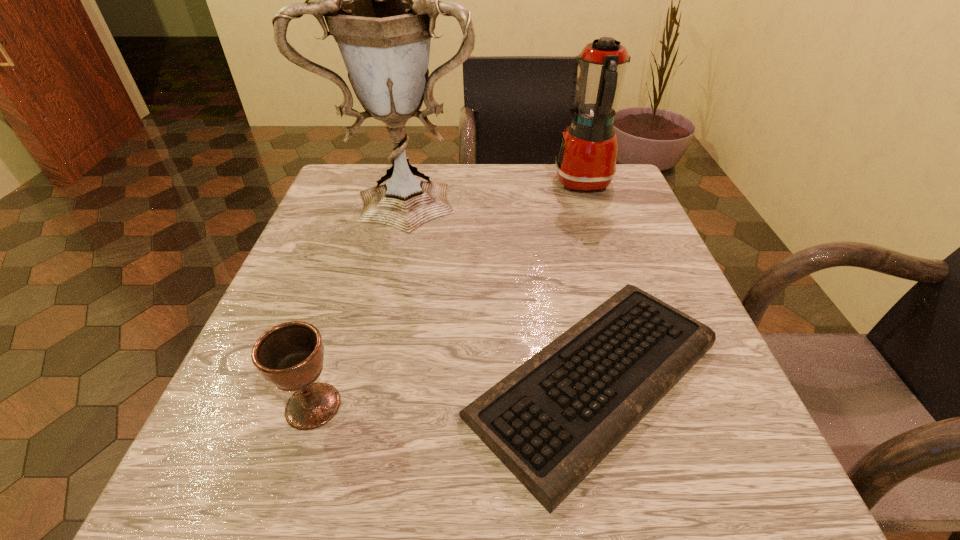
The width and height of the screenshot is (960, 540). Identify the location of free location at the far edge of the desktop. (566, 210).

The width and height of the screenshot is (960, 540). Identify the location of free space at the near edge of the desktop. (438, 453).

This screenshot has width=960, height=540. Identify the location of vacant space at the left edge. (334, 285).

In the image, there is a desktop. Where is `vacant space at the right edge`? vacant space at the right edge is located at coordinates click(x=605, y=295).

This screenshot has height=540, width=960. I want to click on vacant space at the near left corner, so click(214, 492).

Locate an element on the screen. vacant area at the far right corner is located at coordinates (628, 201).

Locate an element on the screen. The image size is (960, 540). free space between the food processor and the tallest object is located at coordinates (496, 190).

Where is `blank region between the food processor and the computer keyboard`? blank region between the food processor and the computer keyboard is located at coordinates (588, 281).

Where is `free space between the computer keyboard and the tallest object`? The image size is (960, 540). free space between the computer keyboard and the tallest object is located at coordinates (502, 287).

Locate an element on the screen. Image resolution: width=960 pixels, height=540 pixels. blank region between the second tallest object and the trophy cup is located at coordinates (496, 190).